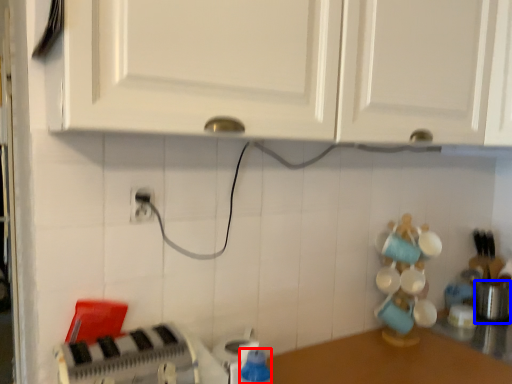
Question: Among these objects, which one is nearest to the camera, bottle (highlighted by a red box) or appliance (highlighted by a blue box)?

Choices:
 (A) bottle
 (B) appliance

Answer: (A)